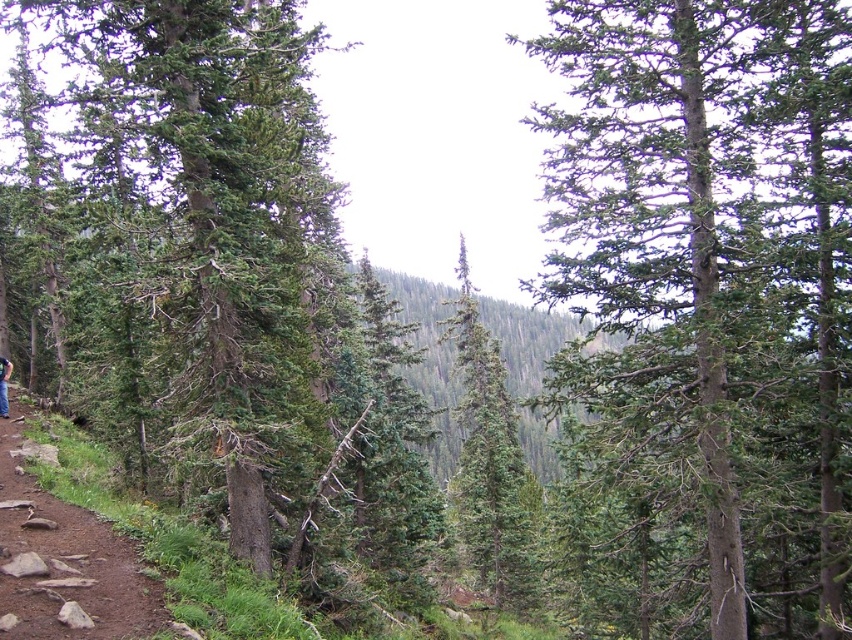
In the scene shown: Between green rough bark tree at center and blue fabric hiker at lower left, which one appears on the left side from the viewer's perspective?

From the viewer's perspective, blue fabric hiker at lower left appears more on the left side.

Can you confirm if green rough bark tree at center is wider than blue fabric hiker at lower left?

Correct, the width of green rough bark tree at center exceeds that of blue fabric hiker at lower left.

Which is in front, point (579, 268) or point (10, 369)?

Point (579, 268)

In order to click on green rough bark tree at center in this screenshot , I will do `click(711, 296)`.

Between dirt path at lower left and blue fabric hiker at lower left, which one is positioned higher?

Positioned higher is blue fabric hiker at lower left.

In order to click on dirt path at lower left in this screenshot , I will do `click(65, 563)`.

Does point (91, 605) lie in front of point (9, 362)?

That is True.

Where is `dirt path at lower left`? This screenshot has height=640, width=852. dirt path at lower left is located at coordinates (65, 563).

Does green matte tree at center have a smaller size compared to blue fabric hiker at lower left?

No, green matte tree at center is not smaller than blue fabric hiker at lower left.

Can you confirm if green matte tree at center is bigger than blue fabric hiker at lower left?

Yes.

You are a GUI agent. You are given a task and a screenshot of the screen. Output one action in this format:
    pyautogui.click(x=<x>, y=<y>)
    Task: Click on the green matte tree at center
    
    Given the screenshot: What is the action you would take?
    pyautogui.click(x=488, y=461)

Where is `green matte tree at center`? The height and width of the screenshot is (640, 852). green matte tree at center is located at coordinates (488, 461).